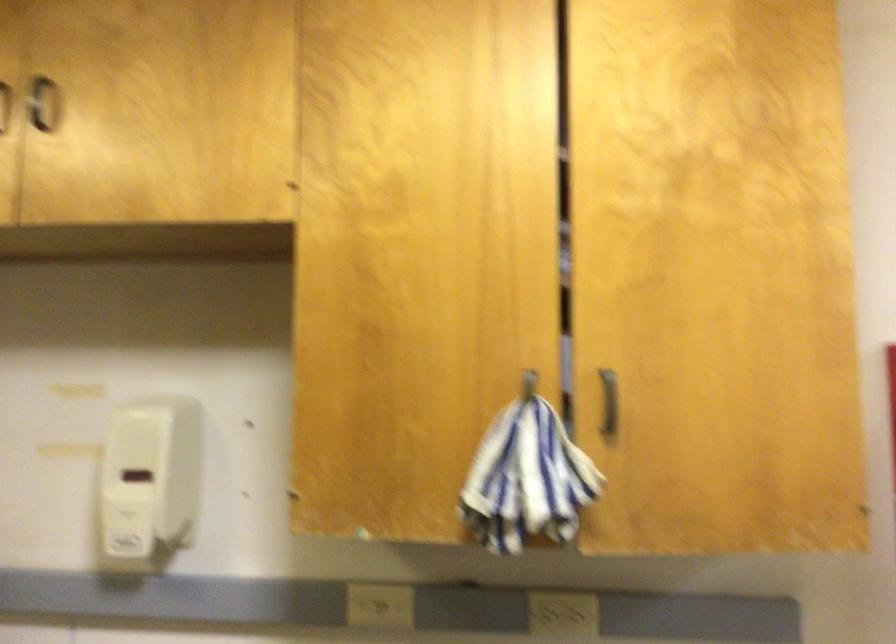
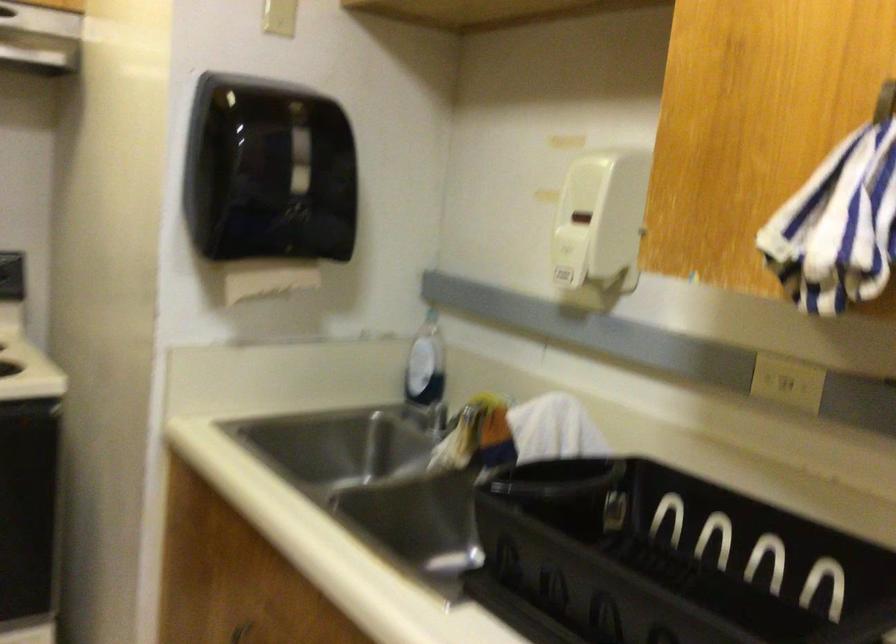
Question: The images are taken continuously from a first-person perspective. In which direction is your viewpoint rotating?

Choices:
 (A) Left
 (B) Right
 (C) Up
 (D) Down

Answer: (A)